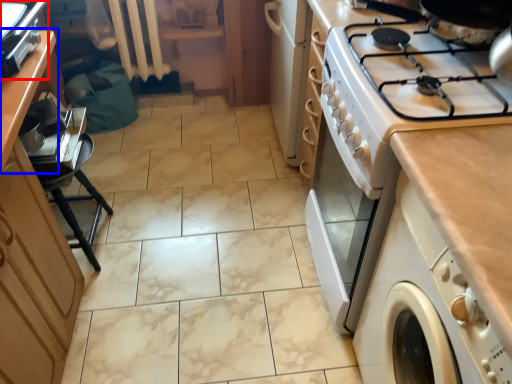
Question: Which object appears farthest to the camera in this image, home appliance (highlighted by a red box) or counter (highlighted by a blue box)?

Choices:
 (A) home appliance
 (B) counter

Answer: (B)